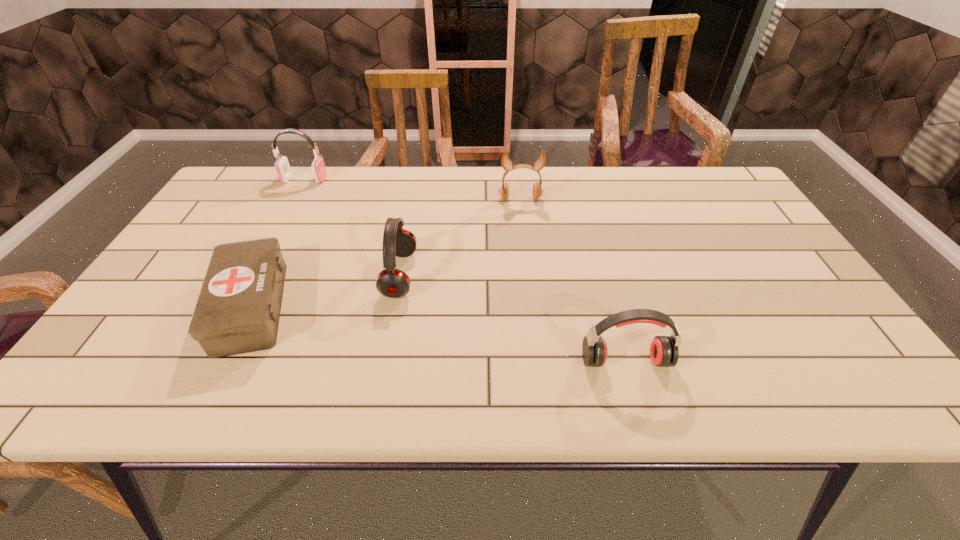
Locate an element on the screen. free region located on the front-facing side of the fourth nearest object is located at coordinates (530, 279).

Identify the location of free region located on the ear cups of the third object from right to left. (480, 275).

Find the location of a particular element. vacant space located 0.200m on the back of the first-aid kit is located at coordinates (297, 217).

The width and height of the screenshot is (960, 540). In order to click on object located in the near edge section of the desktop in this screenshot , I will do `click(664, 352)`.

Where is `blank area at the far edge`? The image size is (960, 540). blank area at the far edge is located at coordinates (548, 186).

Image resolution: width=960 pixels, height=540 pixels. Find the location of `vacant space at the near edge of the desktop`. vacant space at the near edge of the desktop is located at coordinates (729, 386).

Locate an element on the screen. This screenshot has height=540, width=960. free region at the left edge is located at coordinates (181, 258).

You are a GUI agent. You are given a task and a screenshot of the screen. Output one action in this format:
    pyautogui.click(x=<x>, y=<y>)
    Task: Click on the vacant region at the far left corner of the desktop
    
    Given the screenshot: What is the action you would take?
    pyautogui.click(x=271, y=174)

At what (x,y) coordinates should I click in order to perform the action: click on free location at the far right corner of the desktop. Please return your answer as a coordinate pair (x, y). This screenshot has height=540, width=960. Looking at the image, I should click on (723, 186).

This screenshot has height=540, width=960. What are the coordinates of `vacant area between the nearest earphone and the first-aid kit` in the screenshot? It's located at (438, 334).